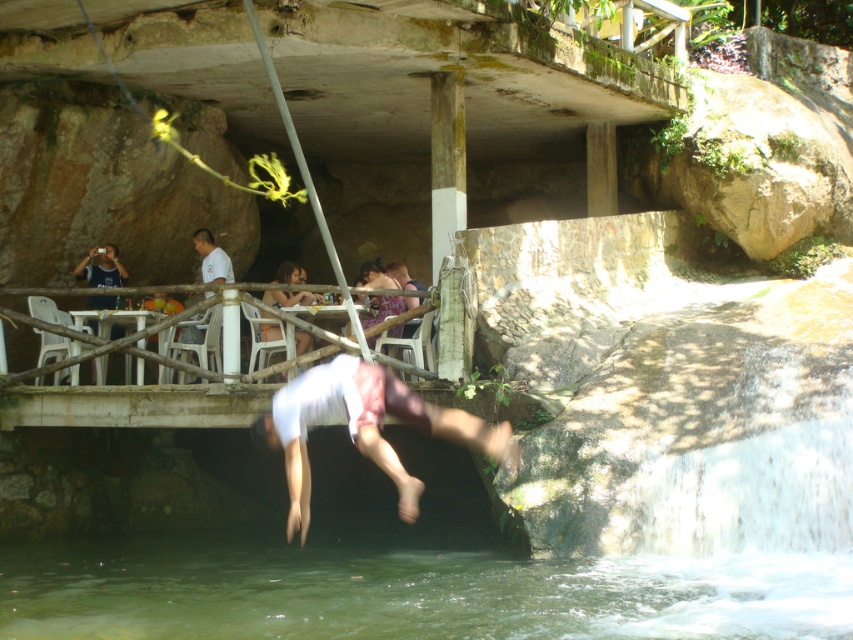
You are standing at the diving spot and want to know which of the two points, point (x=270, y=298) or point (x=376, y=268), is closer to you. Based on the scene, can you determine this?

Point (x=270, y=298) is closer to the viewer than point (x=376, y=268).

You are standing at the point labeled point (286, 276) and want to walk to the point labeled point (259, 579). Based on the scene, which direction should you move to reach your destination?

You should move forward because point (259, 579) is in front of point (286, 276).

In the scene shown: You are standing at the edge of the water and see the clear water at lower center and the matte purple dress at center. Which object is closer to your current position?

The clear water at lower center is closer to your current position because it is located below the matte purple dress at center, placing it nearer to the edge where you are standing.